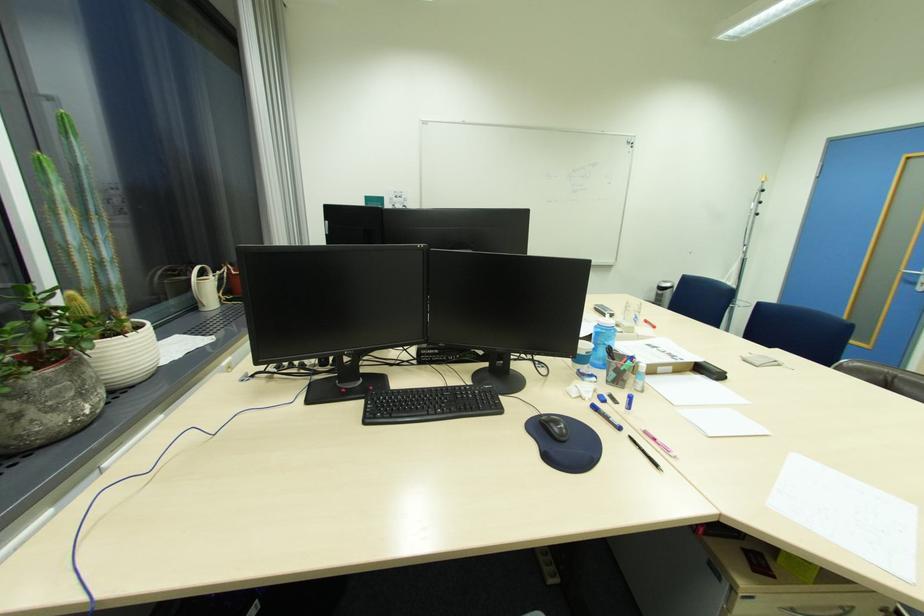
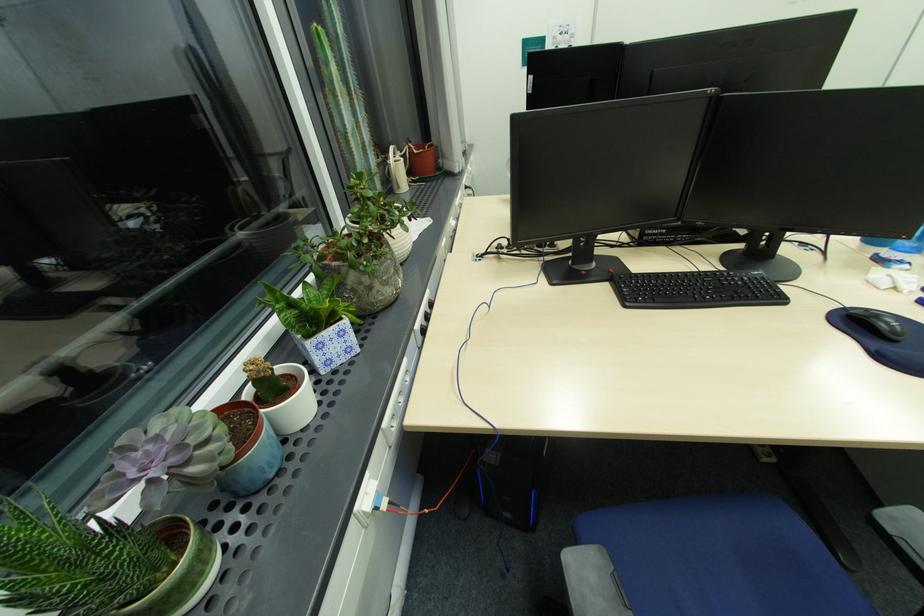
First-person continuous shooting, in which direction is the camera rotating?

The camera's rotation is toward left-down.